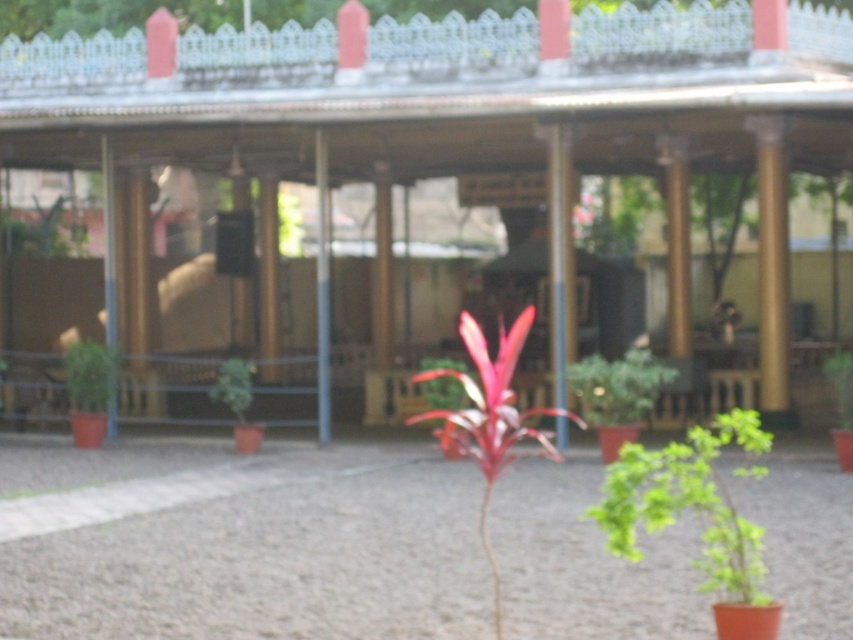
Question: Is green leafy plant at center positioned at the back of green matte plant at center?

Choices:
 (A) yes
 (B) no

Answer: (B)

Question: Does bright red leafy plant at center have a larger size compared to green matte plant at right?

Choices:
 (A) no
 (B) yes

Answer: (B)

Question: Which point is closer to the camera taking this photo?

Choices:
 (A) (700, 456)
 (B) (65, 234)
 (C) (842, 416)

Answer: (A)

Question: Which object is farther from the camera taking this photo?

Choices:
 (A) green matte plant at left
 (B) green matte plant at upper left
 (C) matte wood gazebo at center

Answer: (B)

Question: Can you confirm if green leafy plant at center is positioned to the right of green matte plant at right?

Choices:
 (A) yes
 (B) no

Answer: (B)

Question: Among these objects, which one is farthest from the camera?

Choices:
 (A) green matte plant at lower right
 (B) matte wood gazebo at center

Answer: (B)